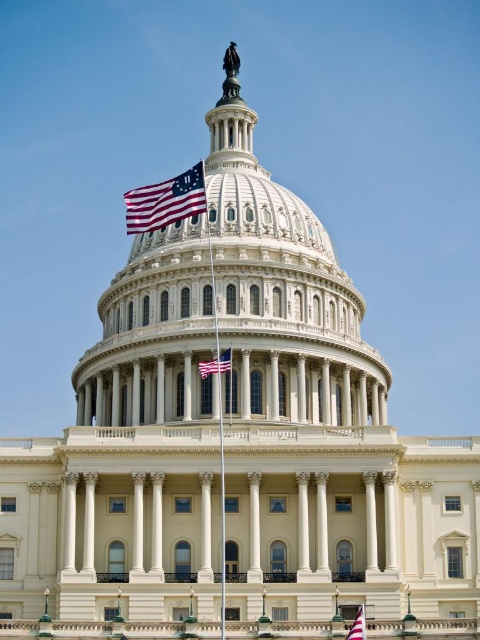
Is white marble dome at center positioned behind red fabric flag at lower right?

Yes, it is behind red fabric flag at lower right.

Is point (128, 328) farther from viewer compared to point (361, 605)?

That is True.

Locate an element on the screen. white marble dome at center is located at coordinates (232, 305).

Is polished metal flag pole at center positioned in front of red fabric flag at lower right?

No.

Does polished metal flag pole at center have a lesser height compared to red fabric flag at lower right?

No, polished metal flag pole at center is not shorter than red fabric flag at lower right.

You are a GUI agent. You are given a task and a screenshot of the screen. Output one action in this format:
    pyautogui.click(x=<x>, y=<y>)
    Task: Click on the polished metal flag pole at center
    This screenshot has height=640, width=480.
    Given the screenshot: What is the action you would take?
    pyautogui.click(x=218, y=426)

Find the location of a particular element. polished metal flag pole at center is located at coordinates (218, 426).

Which is behind, point (184, 396) or point (224, 371)?

The point (184, 396) is behind.

Does white marble dome at center have a lesser height compared to american flag at center?

No.

Who is more forward, (x=240, y=403) or (x=227, y=364)?

Point (x=227, y=364)

Find the location of a particular element. white marble dome at center is located at coordinates (232, 305).